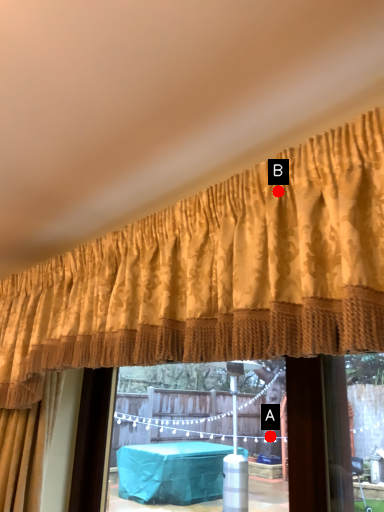
Question: Two points are circled on the image, labeled by A and B beside each circle. Which point is closer to the camera?

Choices:
 (A) A is closer
 (B) B is closer

Answer: (B)